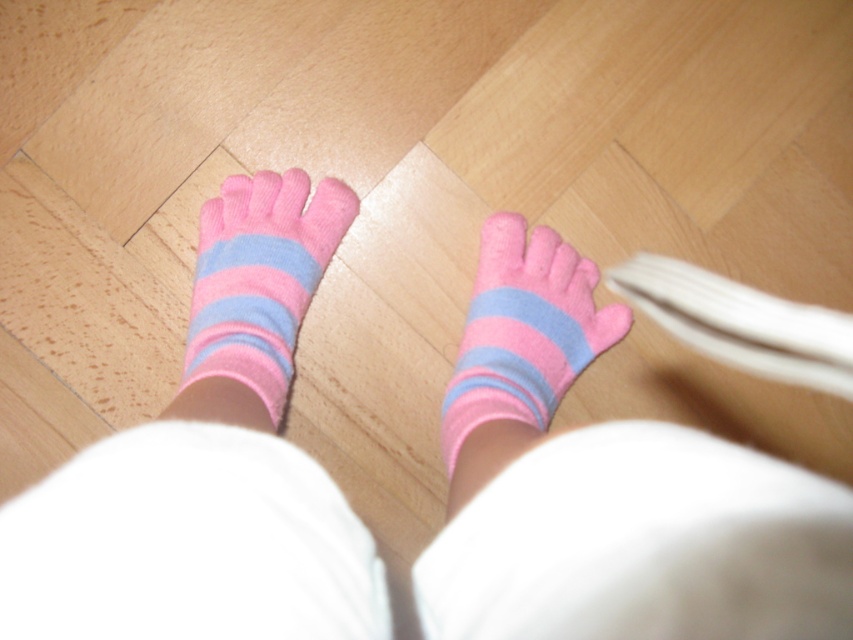
You are holding a 12 inch ruler and want to measure the distance from your eyes to the point marked at coordinates point (549,579) in the image. Can you determine if the distance is within the ruler length?

The distance from the viewer to point (549,579) is 11.36 inches, which is less than the 12 inch ruler length. Therefore, the distance can be measured with the ruler.

Consider the image. You are trying to decide which pair of socks to wear. You see the pink soft socks at center and the pink fuzzy socks at center in the image. Which one is located lower on your feet?

The pink soft socks at center is located lower on your feet because it is positioned below the pink fuzzy socks at center.

You are a robot trying to navigate between two points in the image. The first point is point (x=282, y=310) and the second point is point (x=492, y=332). Since the person is standing on the wooden floor, which point is closer to the front of the person?

Point (x=282, y=310) is in front of point (x=492, y=332), so the first point is closer to the front of the person.